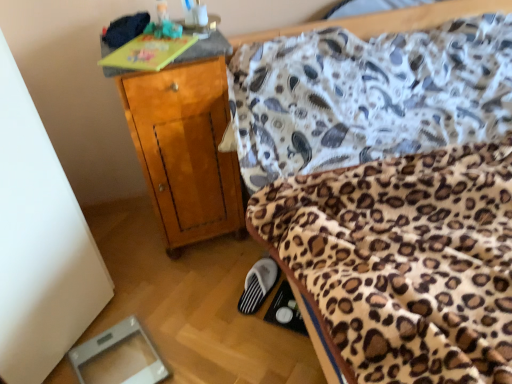
Question: From the image's perspective, is wooden nightstand at upper left located above or below black suede slipper at lower center?

Choices:
 (A) above
 (B) below

Answer: (A)

Question: Does point (209, 155) appear closer or farther from the camera than point (266, 271)?

Choices:
 (A) farther
 (B) closer

Answer: (B)

Question: Is wooden nightstand at upper left taller or shorter than black suede slipper at lower center?

Choices:
 (A) short
 (B) tall

Answer: (B)

Question: Is black suede slipper at lower center to the left or to the right of wooden nightstand at upper left in the image?

Choices:
 (A) left
 (B) right

Answer: (B)

Question: From a real-world perspective, is black suede slipper at lower center positioned above or below wooden nightstand at upper left?

Choices:
 (A) above
 (B) below

Answer: (B)

Question: Is point (252, 279) closer or farther from the camera than point (153, 147)?

Choices:
 (A) closer
 (B) farther

Answer: (B)

Question: Is black suede slipper at lower center taller or shorter than wooden nightstand at upper left?

Choices:
 (A) tall
 (B) short

Answer: (B)